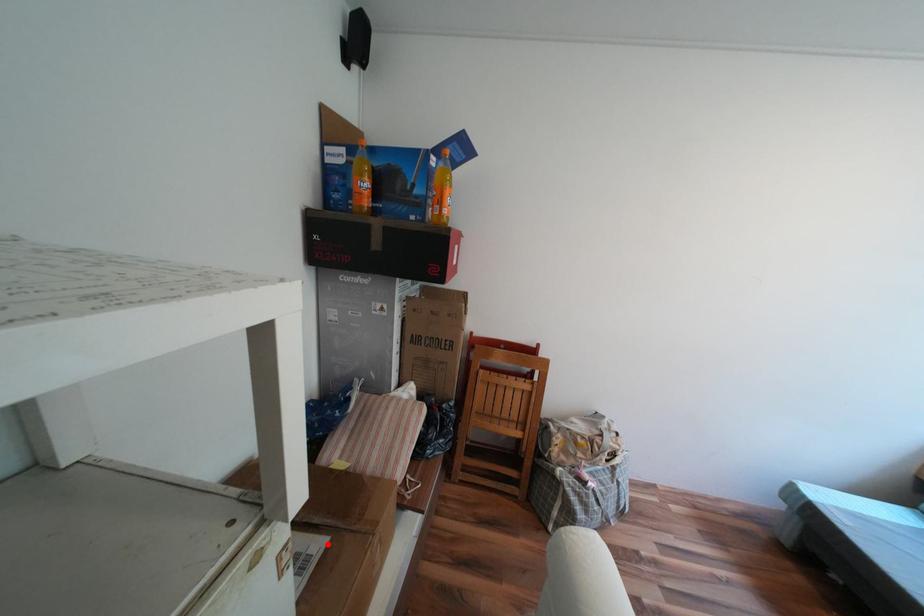
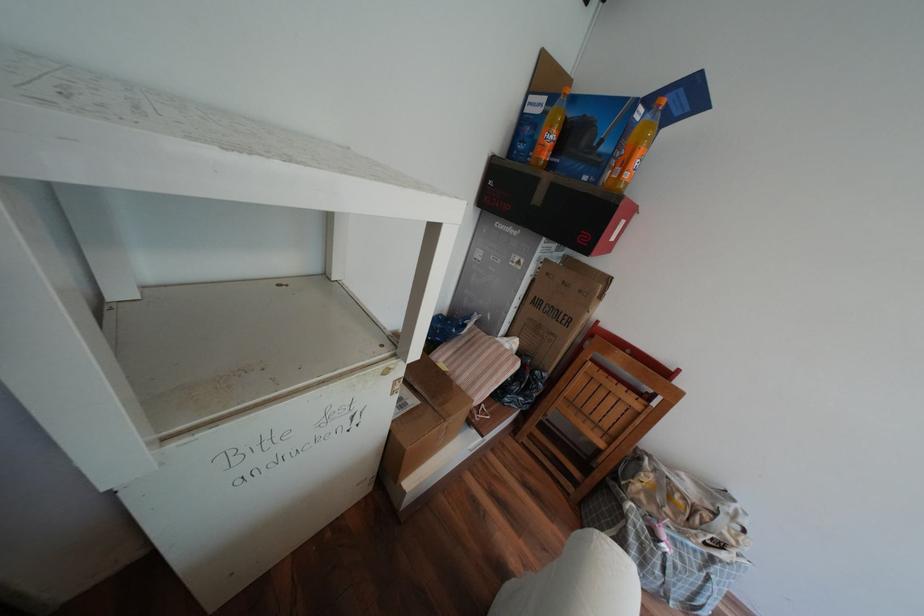
Question: I am providing you with two images of the same scene from different viewpoints. A red point is marked on the first image. Can you still see the location of the red point in image 2?

Choices:
 (A) Yes
 (B) No

Answer: (A)